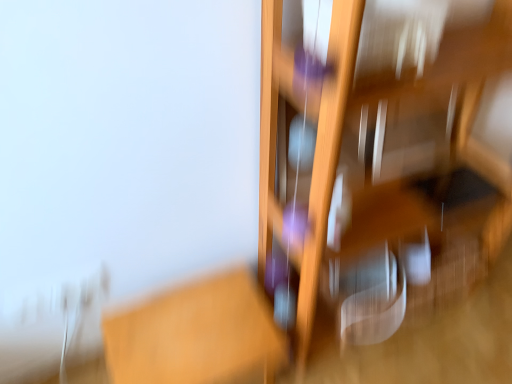
Question: Is wooden shelf at right bigger or smaller than wooden table at center?

Choices:
 (A) big
 (B) small

Answer: (A)

Question: In the image, is wooden shelf at right positioned in front of or behind wooden table at center?

Choices:
 (A) behind
 (B) front

Answer: (B)

Question: Visually, is wooden shelf at right positioned to the left or to the right of wooden table at center?

Choices:
 (A) left
 (B) right

Answer: (B)

Question: In the image, is wooden table at center positioned in front of or behind wooden shelf at right?

Choices:
 (A) front
 (B) behind

Answer: (B)

Question: Is point (160, 360) positioned closer to the camera than point (329, 119)?

Choices:
 (A) farther
 (B) closer

Answer: (A)

Question: From the image's perspective, relative to wooden shelf at right, is wooden table at center above or below?

Choices:
 (A) below
 (B) above

Answer: (A)

Question: Considering the positions of wooden table at center and wooden shelf at right in the image, is wooden table at center wider or thinner than wooden shelf at right?

Choices:
 (A) thin
 (B) wide

Answer: (A)